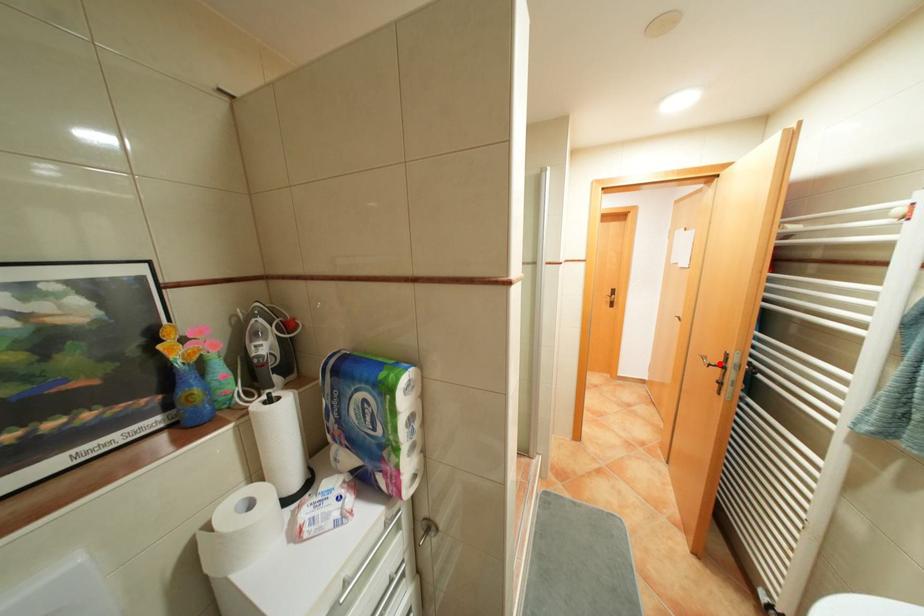
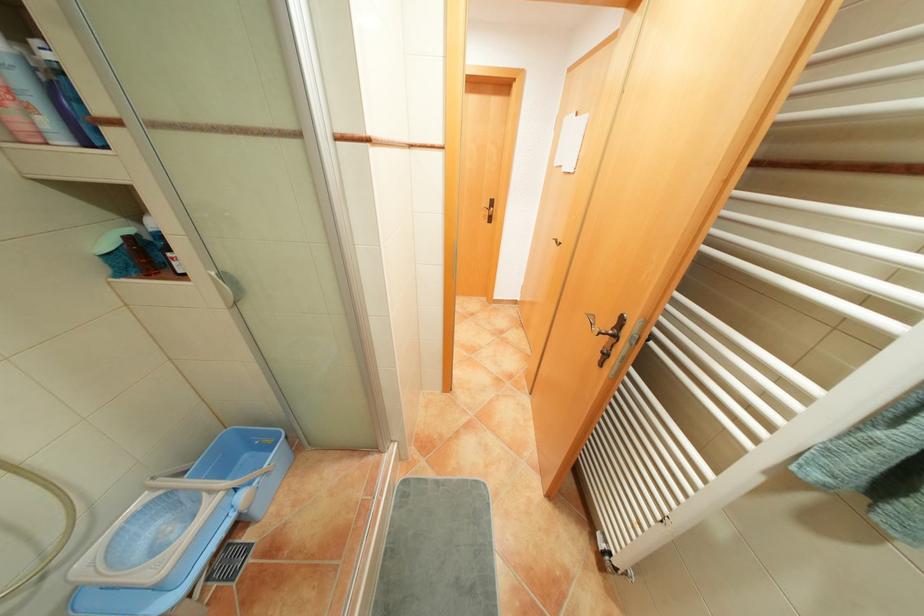
Where in the second image is the point corresponding to the highlighted location from the first image?

(609, 333)